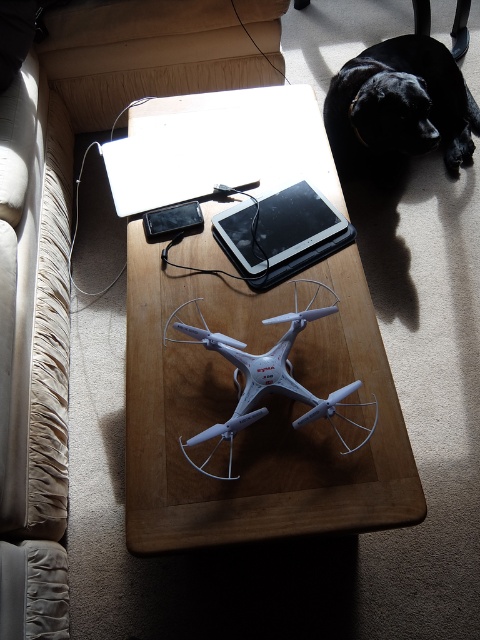
Can you confirm if white matte drone at center is shorter than black matte tablet at upper center?

In fact, white matte drone at center may be taller than black matte tablet at upper center.

Is white matte drone at center further to camera compared to black matte tablet at upper center?

That is False.

Does point (268, 385) come closer to viewer compared to point (146, 230)?

Yes, point (268, 385) is closer to viewer.

Locate an element on the screen. white matte drone at center is located at coordinates (266, 378).

Is black matte tablet at center shorter than black matte tablet at upper center?

No, black matte tablet at center is not shorter than black matte tablet at upper center.

Can you confirm if black matte tablet at center is taller than black matte tablet at upper center?

Correct, black matte tablet at center is much taller as black matte tablet at upper center.

Between point (264, 240) and point (169, 218), which one is positioned in front?

Point (264, 240)

The width and height of the screenshot is (480, 640). What are the coordinates of `black matte tablet at center` in the screenshot? It's located at (276, 227).

Does beige fabric couch at left have a larger size compared to black matte tablet at upper center?

Yes.

Can you confirm if beige fabric couch at left is wider than black matte tablet at upper center?

Yes, beige fabric couch at left is wider than black matte tablet at upper center.

Describe the element at coordinates (34, 356) in the screenshot. I see `beige fabric couch at left` at that location.

The width and height of the screenshot is (480, 640). Identify the location of beige fabric couch at left. (34, 356).